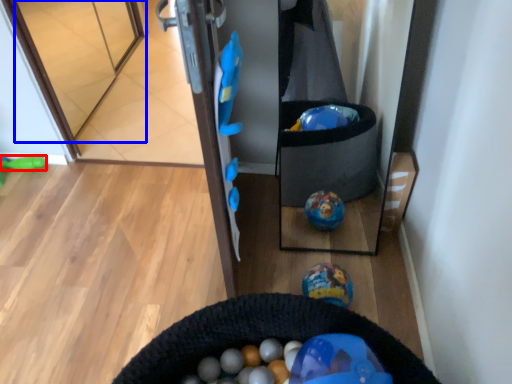
Question: Which object appears closest to the camera in this image, toy (highlighted by a red box) or glass door (highlighted by a blue box)?

Choices:
 (A) toy
 (B) glass door

Answer: (B)